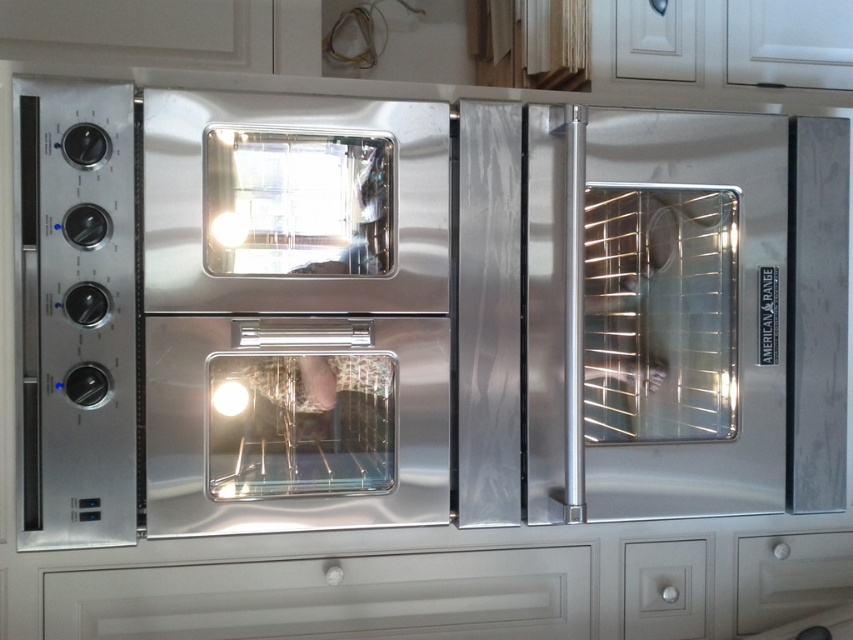
Question: Among these points, which one is farthest from the camera?

Choices:
 (A) (106, 323)
 (B) (817, 602)

Answer: (B)

Question: Which point is farther to the camera?

Choices:
 (A) (142, 145)
 (B) (822, 588)

Answer: (B)

Question: Does stainless steel oven at center appear over matte white drawer at lower right?

Choices:
 (A) yes
 (B) no

Answer: (A)

Question: Is stainless steel oven at center thinner than matte white drawer at lower right?

Choices:
 (A) no
 (B) yes

Answer: (A)

Question: Is stainless steel oven at center above matte white drawer at lower right?

Choices:
 (A) no
 (B) yes

Answer: (B)

Question: Which of the following is the closest to the observer?

Choices:
 (A) stainless steel oven at center
 (B) matte white drawer at lower right

Answer: (A)